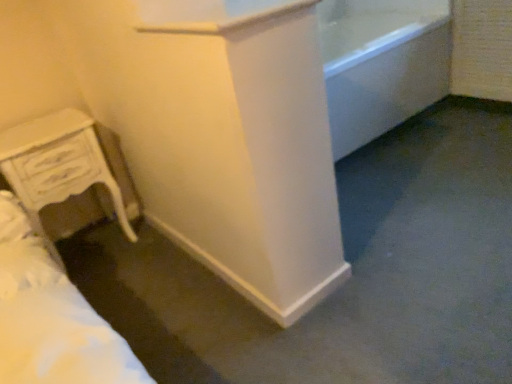
Question: From a real-world perspective, is white glossy bathtub at upper right positioned above or below white wood chest of drawers at lower left?

Choices:
 (A) above
 (B) below

Answer: (B)

Question: Considering the positions of white glossy bathtub at upper right and white wood chest of drawers at lower left in the image, is white glossy bathtub at upper right taller or shorter than white wood chest of drawers at lower left?

Choices:
 (A) short
 (B) tall

Answer: (A)

Question: Would you say white glossy bathtub at upper right is inside or outside white wood chest of drawers at lower left?

Choices:
 (A) inside
 (B) outside

Answer: (B)

Question: Is white wood chest of drawers at lower left taller or shorter than white glossy bathtub at upper right?

Choices:
 (A) short
 (B) tall

Answer: (B)

Question: Looking at their shapes, would you say white wood chest of drawers at lower left is wider or thinner than white glossy bathtub at upper right?

Choices:
 (A) wide
 (B) thin

Answer: (B)

Question: Considering their positions, is white wood chest of drawers at lower left located in front of or behind white glossy bathtub at upper right?

Choices:
 (A) behind
 (B) front

Answer: (B)

Question: Looking at the image, does white wood chest of drawers at lower left seem bigger or smaller compared to white glossy bathtub at upper right?

Choices:
 (A) small
 (B) big

Answer: (A)